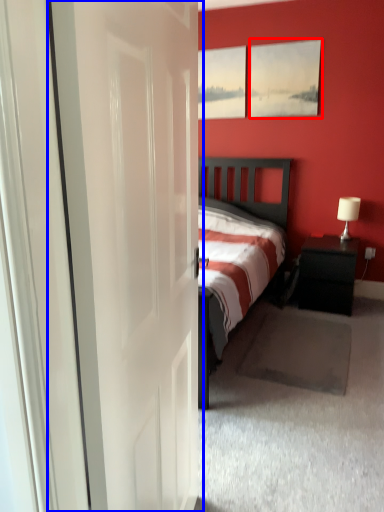
Question: Which of the following is the closest to the observer, picture frame (highlighted by a red box) or door (highlighted by a blue box)?

Choices:
 (A) picture frame
 (B) door

Answer: (B)